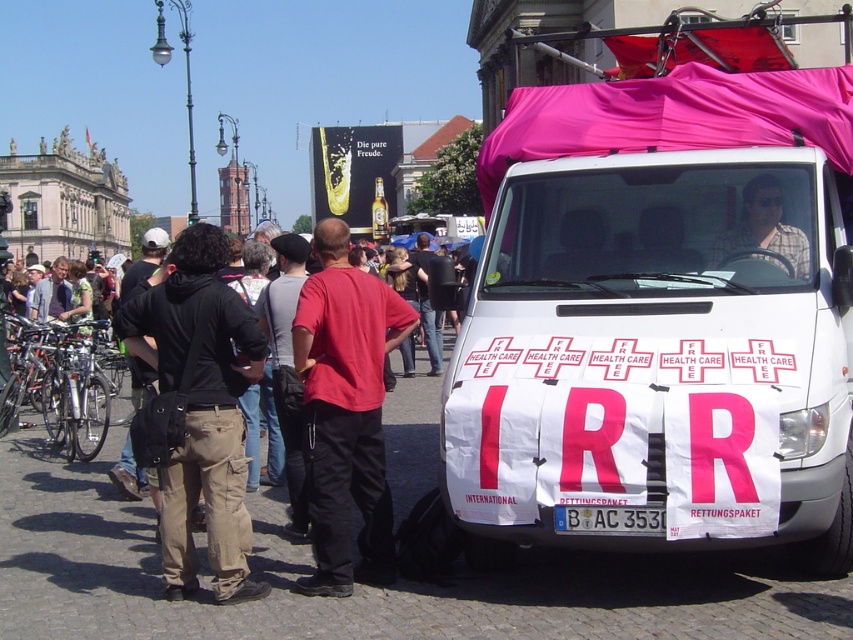
Between point (717, 243) and point (642, 522), which one is positioned behind?

Positioned behind is point (717, 243).

Is plaid shirt at center bigger than white plastic license plate at center?

Yes.

The image size is (853, 640). Find the location of `plaid shirt at center`. plaid shirt at center is located at coordinates (762, 230).

Who is higher up, white fabric van at right or white plastic license plate at center?

white fabric van at right is above.

Is point (650, 136) less distant than point (659, 524)?

No, it is behind (659, 524).

At what (x,y) coordinates should I click in order to perform the action: click on white fabric van at right. Please return your answer as a coordinate pair (x, y). Looking at the image, I should click on (660, 316).

Does black cotton hoodie at left have a greater height compared to red cotton shirt at center?

No, black cotton hoodie at left is not taller than red cotton shirt at center.

Between point (180, 380) and point (374, 502), which one is positioned in front?

Point (180, 380) is more forward.

Describe the element at coordinates (196, 410) in the screenshot. I see `black cotton hoodie at left` at that location.

This screenshot has width=853, height=640. I want to click on black cotton hoodie at left, so click(x=196, y=410).